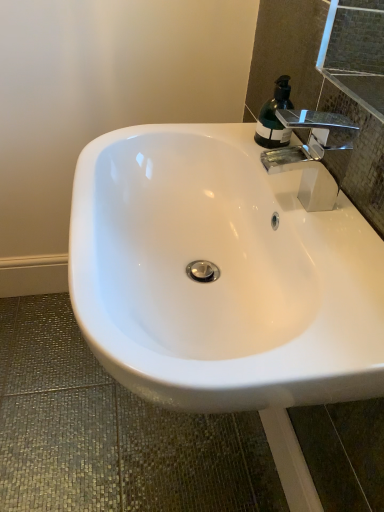
Question: Is chrome/metallic faucet at upper right positioned with its back to white glossy sink at center?

Choices:
 (A) no
 (B) yes

Answer: (A)

Question: Is chrome/metallic faucet at upper right at the right side of white glossy sink at center?

Choices:
 (A) yes
 (B) no

Answer: (A)

Question: Is chrome/metallic faucet at upper right next to white glossy sink at center and touching it?

Choices:
 (A) no
 (B) yes

Answer: (A)

Question: Considering the relative sizes of chrome/metallic faucet at upper right and white glossy sink at center in the image provided, is chrome/metallic faucet at upper right smaller than white glossy sink at center?

Choices:
 (A) no
 (B) yes

Answer: (B)

Question: Would you say chrome/metallic faucet at upper right is outside white glossy sink at center?

Choices:
 (A) yes
 (B) no

Answer: (A)

Question: Relative to chrome/metallic faucet at upper right, is translucent green bottle at upper right in front or behind?

Choices:
 (A) front
 (B) behind

Answer: (B)

Question: Considering the positions of translucent green bottle at upper right and chrome/metallic faucet at upper right in the image, is translucent green bottle at upper right wider or thinner than chrome/metallic faucet at upper right?

Choices:
 (A) wide
 (B) thin

Answer: (B)

Question: From the image's perspective, is translucent green bottle at upper right positioned above or below chrome/metallic faucet at upper right?

Choices:
 (A) above
 (B) below

Answer: (A)

Question: From a real-world perspective, is translucent green bottle at upper right positioned above or below chrome/metallic faucet at upper right?

Choices:
 (A) above
 (B) below

Answer: (B)

Question: From a real-world perspective, is chrome/metallic faucet at upper right physically located above or below white glossy sink at center?

Choices:
 (A) above
 (B) below

Answer: (A)

Question: From the image's perspective, is chrome/metallic faucet at upper right above or below white glossy sink at center?

Choices:
 (A) below
 (B) above

Answer: (B)

Question: Which is correct: chrome/metallic faucet at upper right is inside white glossy sink at center, or outside of it?

Choices:
 (A) outside
 (B) inside

Answer: (A)

Question: Considering the positions of point (276, 114) and point (225, 135), is point (276, 114) closer or farther from the camera than point (225, 135)?

Choices:
 (A) farther
 (B) closer

Answer: (B)

Question: Is chrome/metallic faucet at upper right wider or thinner than translucent green bottle at upper right?

Choices:
 (A) wide
 (B) thin

Answer: (A)

Question: Relative to translucent green bottle at upper right, is chrome/metallic faucet at upper right in front or behind?

Choices:
 (A) front
 (B) behind

Answer: (A)